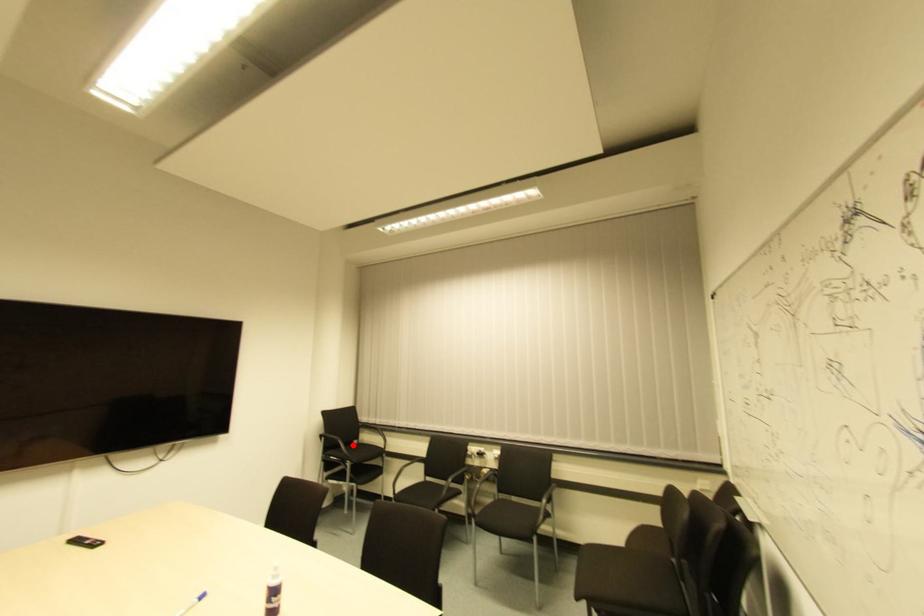
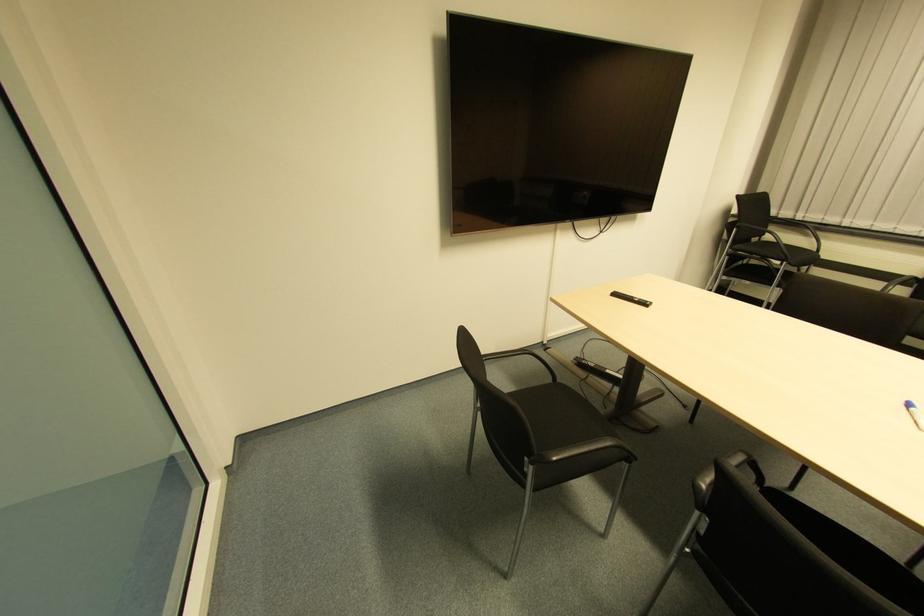
Question: I am providing you with two images of the same scene from different viewpoints. A red point is shown in image1. For the corresponding object point in image2, is it positioned nearer or farther from the camera?

Choices:
 (A) Nearer
 (B) Farther

Answer: (A)